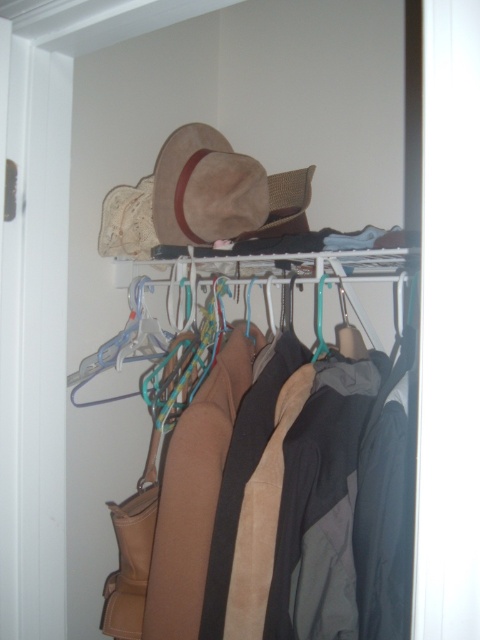
Is suede brown cowboy hat at upper center in front of suede coat at center?

No, it is not.

Which is below, suede brown cowboy hat at upper center or suede coat at center?

Positioned lower is suede coat at center.

The height and width of the screenshot is (640, 480). In order to click on suede brown cowboy hat at upper center in this screenshot , I will do `click(205, 188)`.